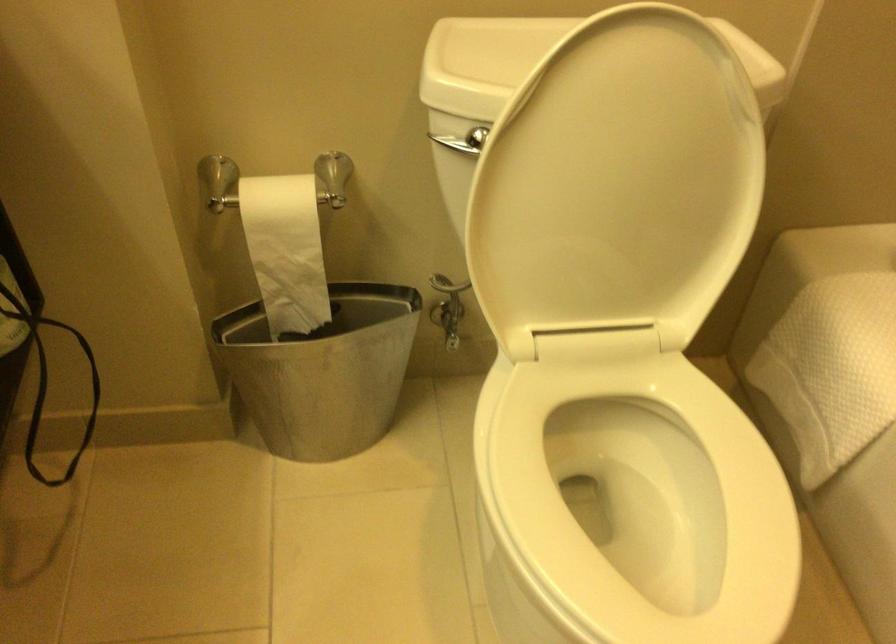
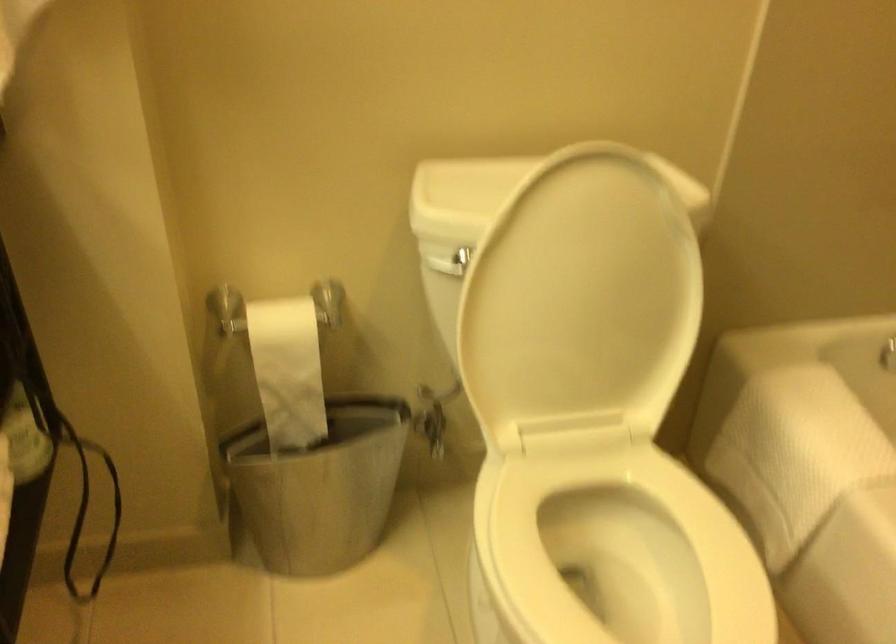
The point at (624, 469) is marked in the first image. Where is the corresponding point in the second image?

(607, 554)